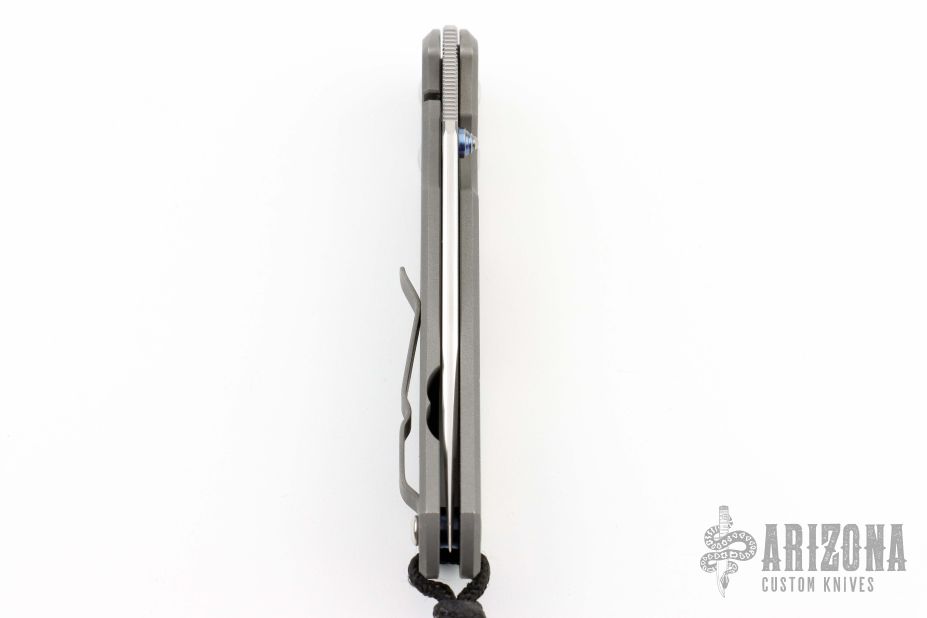
I want to click on handle, so click(x=467, y=208), click(x=436, y=229).